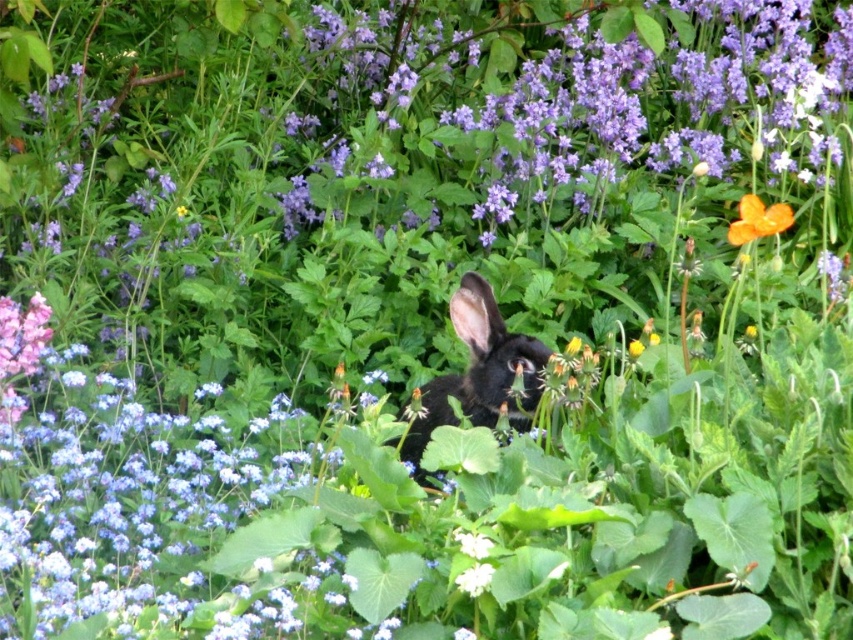
You are standing in the garden and want to place a small decorative statue exactly at the point marked as point (454, 374). If the statue requires a 1.2 meter clearance from any obstacles, will there be enough space around it?

The point (454, 374) is 3.67 meters away from the camera, so there should be sufficient space to place the statue with the required 1.2 meter clearance as long as there are no obstacles within that radius around the point.

You are a gardener observing the garden. You notice the black furry rabbit at center and the orange matte flower at upper right. Which object is taller?

The black furry rabbit at center is taller than the orange matte flower at upper right.